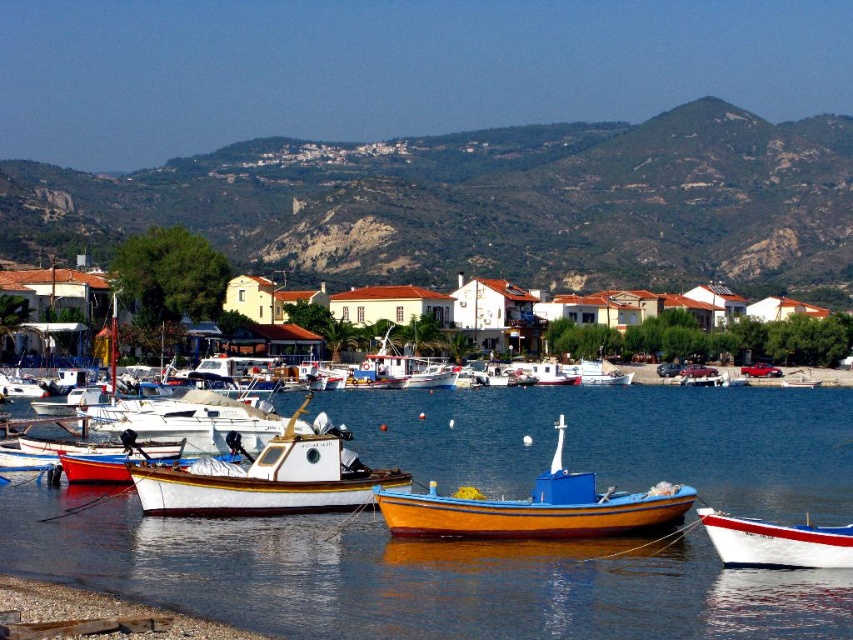
You are standing at the edge of the dock and want to reach a treasure chest located at point (564, 486). There is an obstacle at point (341, 470). Will you encounter the obstacle before reaching the treasure chest?

Yes, you will encounter the obstacle at point (341, 470) before reaching the treasure chest at point (564, 486) because point (341, 470) is closer to the camera than point (564, 486).

You are a tourist standing at the edge of the dock and want to take a photo of the wooden boat at center without the white matte boat at center blocking it. How should you position yourself to achieve this?

Since the wooden boat at center is behind the white matte boat at center, you should move to a position where you can see behind the white matte boat at center, such as moving to the side or further back, to capture the wooden boat at center without obstruction.